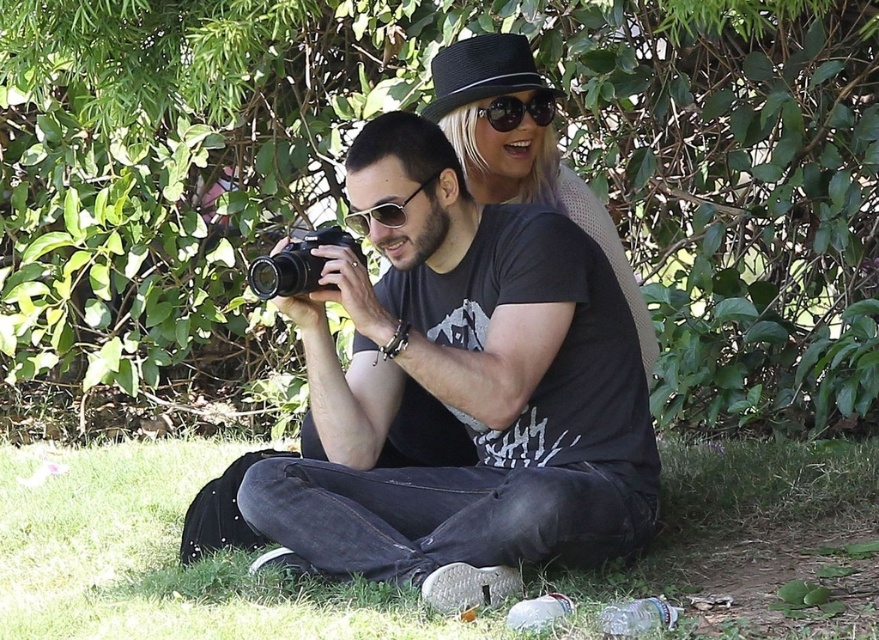
The image size is (879, 640). Find the location of `satin black hat at upper center`. satin black hat at upper center is located at coordinates [521, 150].

Describe the element at coordinates (521, 150) in the screenshot. I see `satin black hat at upper center` at that location.

Between point (512, 42) and point (534, 118), which one is positioned in front?

Positioned in front is point (512, 42).

The image size is (879, 640). In order to click on satin black hat at upper center in this screenshot , I will do `click(521, 150)`.

Who is taller, green leafy tree at center or black plastic camera at center?

green leafy tree at center

Is green leafy tree at center bigger than black plastic camera at center?

Indeed, green leafy tree at center has a larger size compared to black plastic camera at center.

The height and width of the screenshot is (640, 879). Identify the location of green leafy tree at center. (420, 109).

Who is positioned more to the left, green grass at lower center or black reflective sunglasses at upper center?

green grass at lower center is more to the left.

Does point (498, 627) come farther from viewer compared to point (545, 104)?

No, it is not.

This screenshot has width=879, height=640. Identify the location of green grass at lower center. (162, 557).